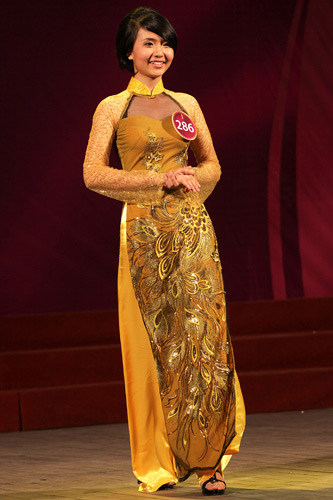
You are a GUI agent. You are given a task and a screenshot of the screen. Output one action in this format:
    pyautogui.click(x=<x>, y=<y>)
    Task: Click on the stage
    
    Given the screenshot: What is the action you would take?
    [x=274, y=476]